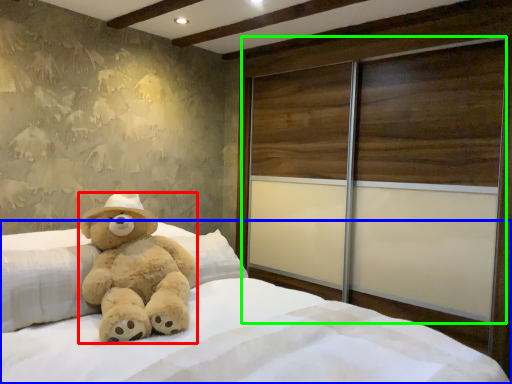
Question: Considering the real-world distances, which object is closest to teddy bear (highlighted by a red box)? bed (highlighted by a blue box) or screen door (highlighted by a green box).

Choices:
 (A) bed
 (B) screen door

Answer: (A)